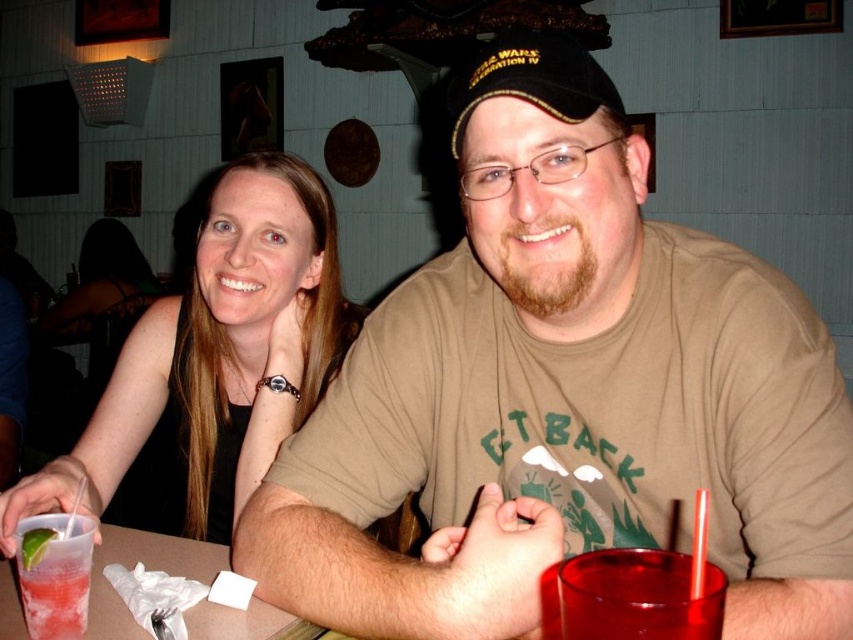
You are a photographer trying to capture a photo of the smooth black tank top at upper left and the clear plastic cup at lower left. Which object should you focus on first if you want to ensure both are in focus, considering their heights?

The smooth black tank top at upper left is taller than the clear plastic cup at lower left. To ensure both are in focus, focus on the smooth black tank top at upper left first since it is taller and likely further away from the camera.